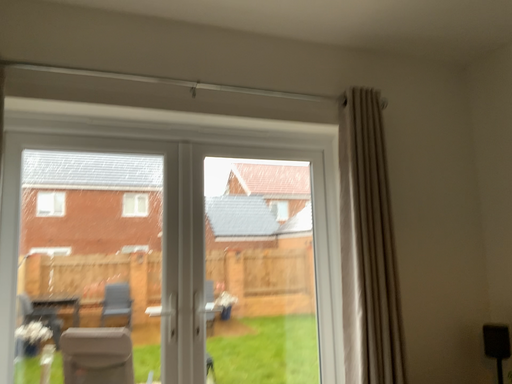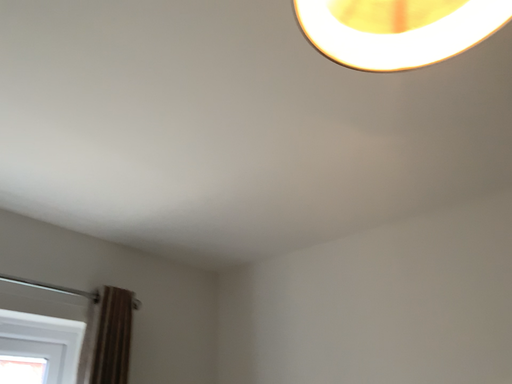
Question: Which way did the camera rotate in the video?

Choices:
 (A) rotated upward
 (B) rotated downward

Answer: (A)